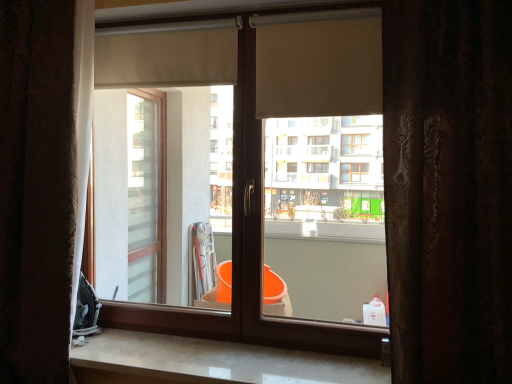
At what (x,y) coordinates should I click in order to perform the action: click on free spot below matte wood window at center (from a real-world perspective). Please return your answer as a coordinate pair (x, y). Looking at the image, I should click on (223, 346).